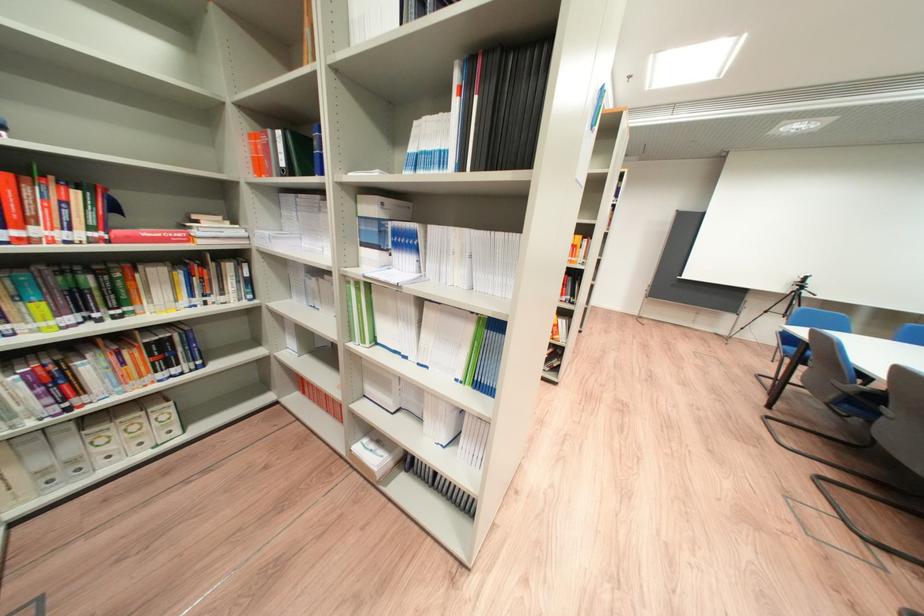
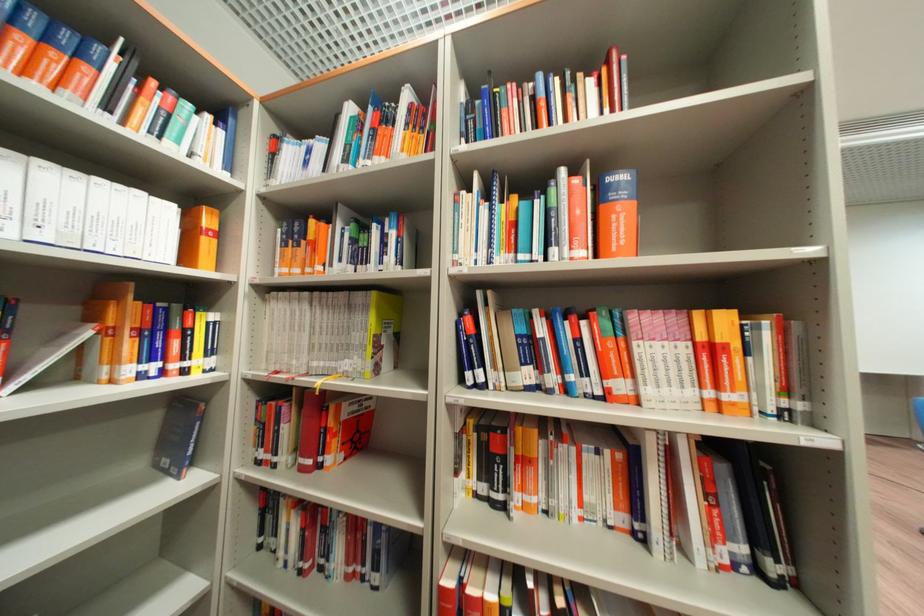
Question: In a continuous first-person perspective shot, in which direction is the camera moving?

Choices:
 (A) Left
 (B) Right
 (C) Forward
 (D) Backward

Answer: (C)